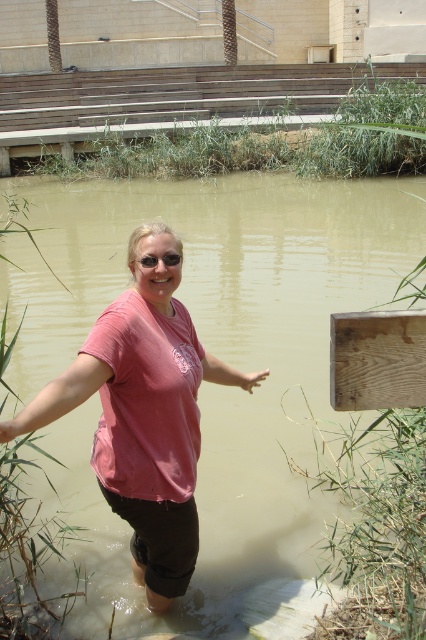
You are a drone operator trying to capture a photo of the person in the water. You need to position your drone between the two points, point (158, 600) and point (180, 259). Which point should you place the drone closer to in order to get a clearer shot of the person?

The drone should be placed closer to point (180, 259) because it is farther from the viewer compared to point (158, 600). This will allow the drone to capture a clearer shot of the person by being positioned closer to the subject.

Looking at this image, you are a drone operator trying to capture a photo of the person in the water. The point at coordinates (143, 413) is part of the pink matte shirt at center. If you want to focus on the pink matte shirt at center, should you adjust the camera to zoom in or out from the current position?

The point at coordinates (143, 413) is already on the pink matte shirt at center, so you do not need to adjust the camera. The current focus is already on the pink matte shirt at center.